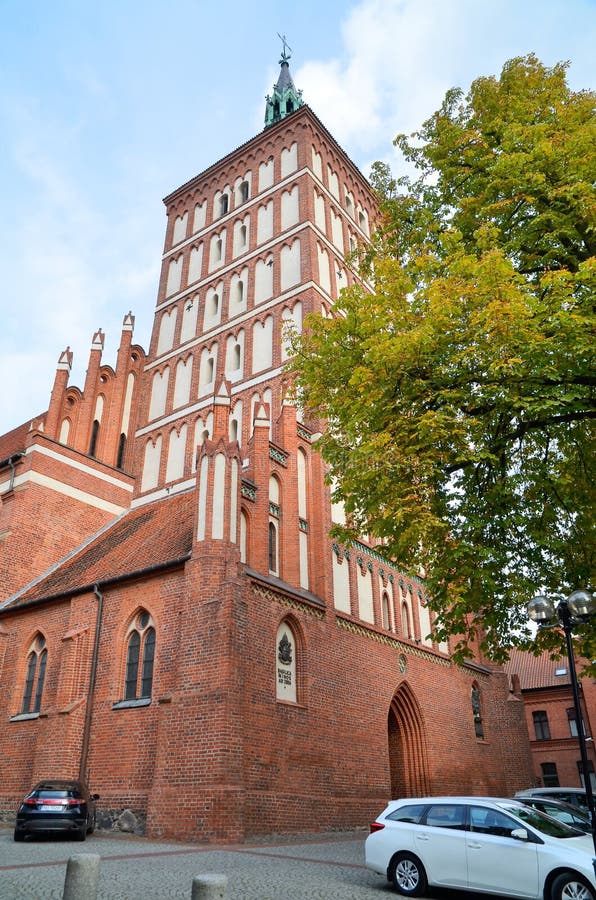
This screenshot has width=596, height=900. I want to click on window, so click(405, 813), click(447, 814), click(502, 821), click(558, 808), click(566, 797), click(583, 801), click(48, 795).